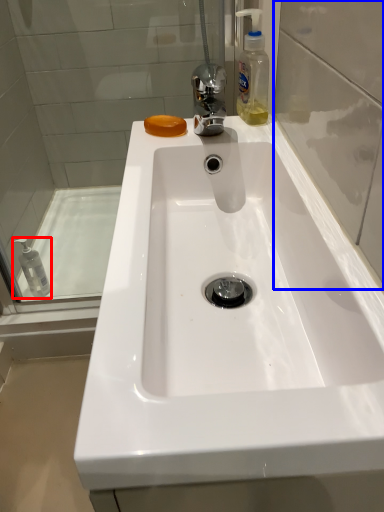
Question: Which object is further to the camera taking this photo, mouthwash (highlighted by a red box) or glass door (highlighted by a blue box)?

Choices:
 (A) mouthwash
 (B) glass door

Answer: (A)